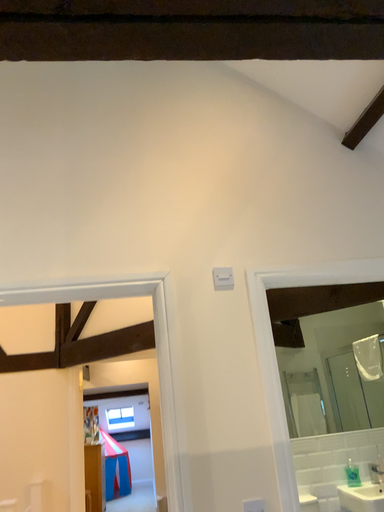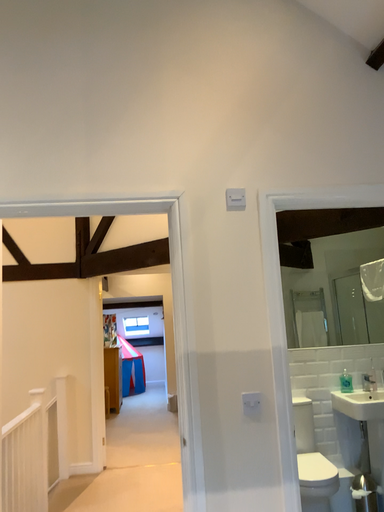
Question: Which way did the camera rotate in the video?

Choices:
 (A) rotated downward
 (B) rotated upward

Answer: (A)